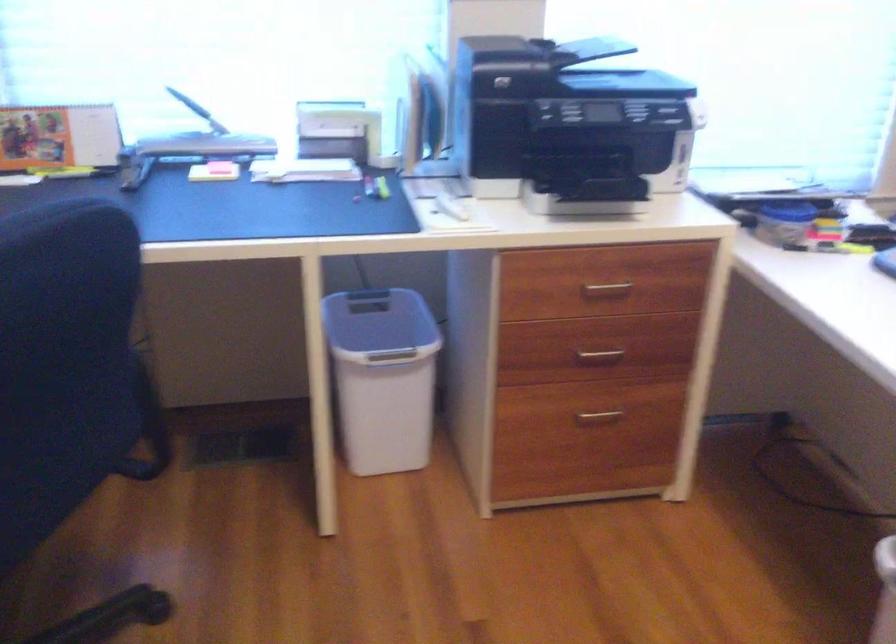
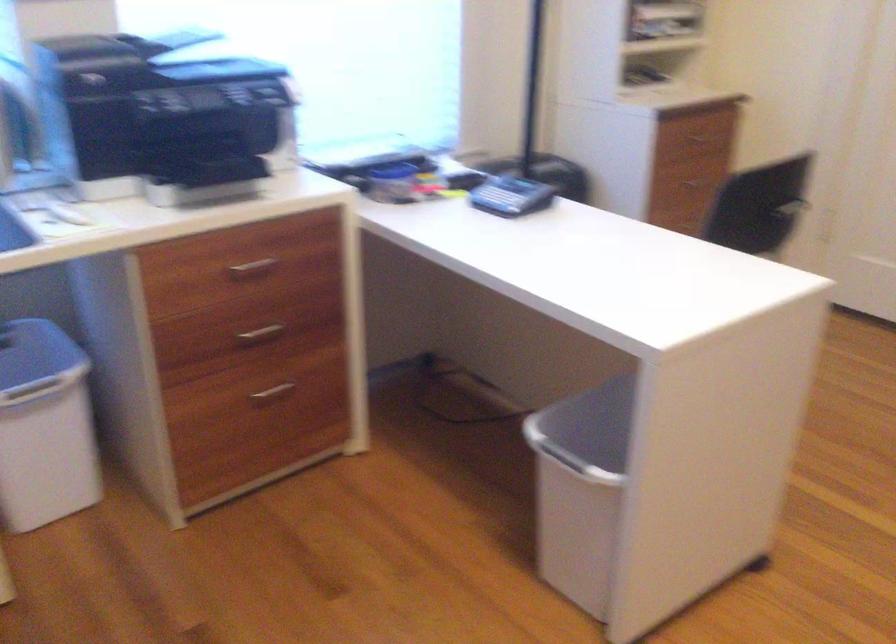
Question: In a continuous first-person perspective shot, in which direction is the camera moving?

Choices:
 (A) Left
 (B) Right
 (C) Forward
 (D) Backward

Answer: (A)